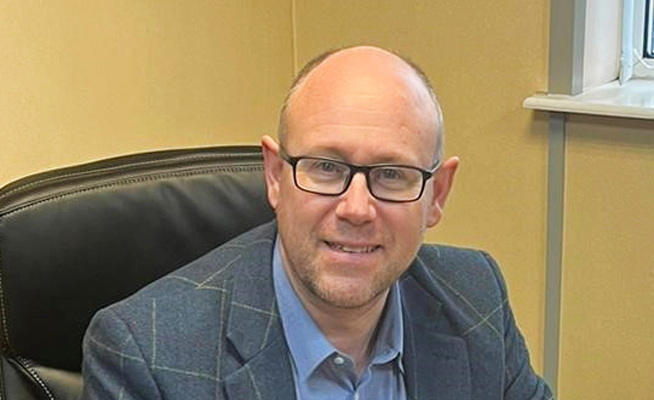
You are a GUI agent. You are given a task and a screenshot of the screen. Output one action in this format:
    pyautogui.click(x=<x>, y=<y>)
    Task: Click on the ends of glasses where arms attach
    
    Given the screenshot: What is the action you would take?
    pyautogui.click(x=288, y=158), pyautogui.click(x=426, y=174)